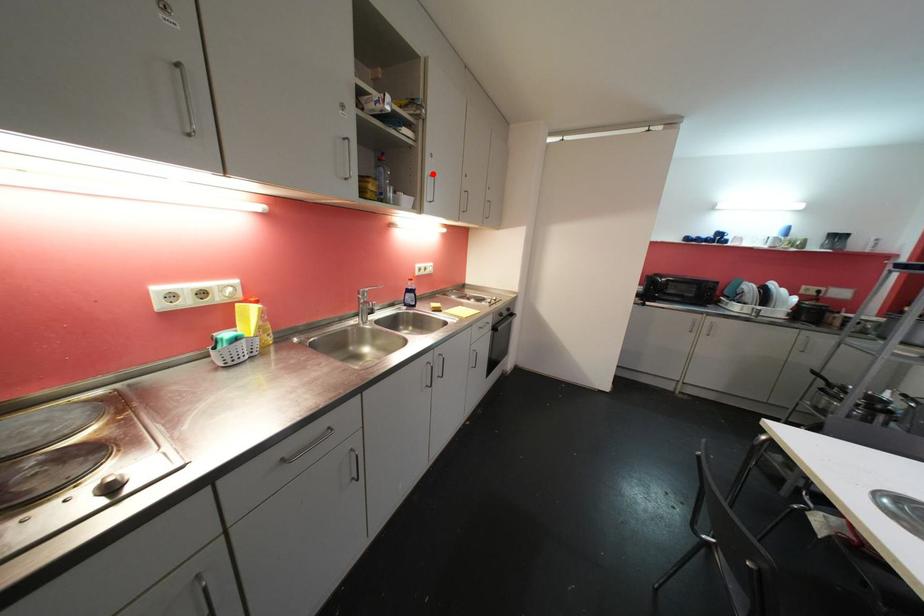
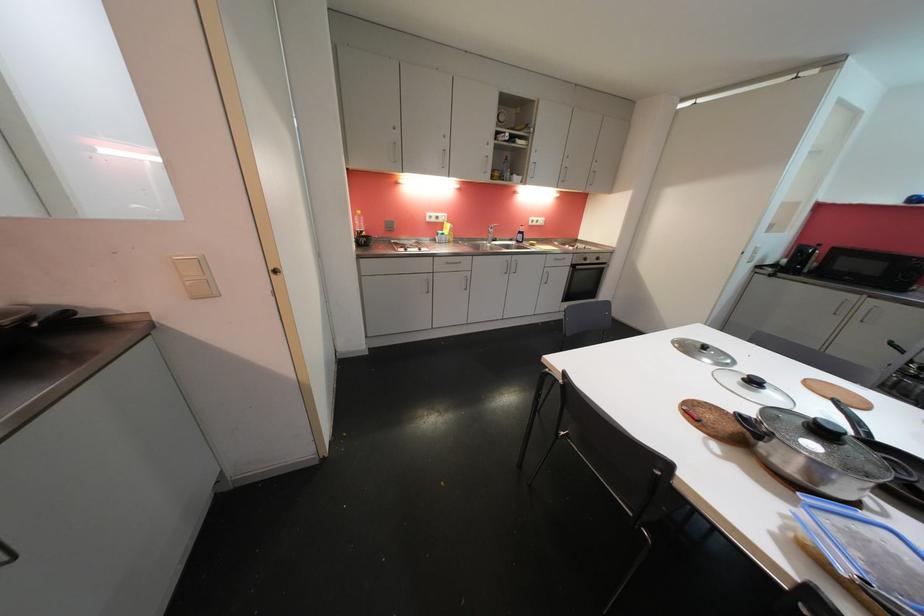
The point at the highlighted location is marked in the first image. Where is the corresponding point in the second image?

(537, 163)